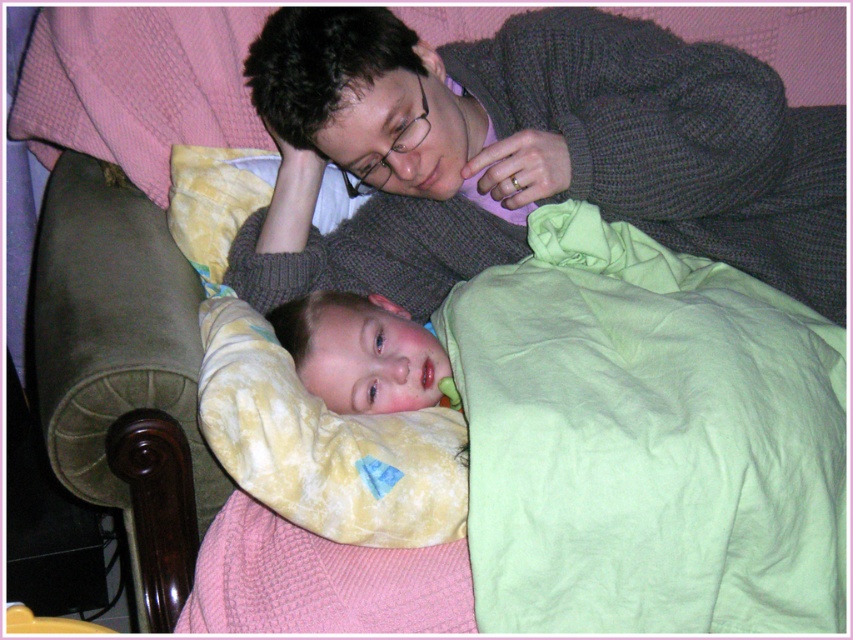
Question: Which point is closer to the camera?

Choices:
 (A) (310, 209)
 (B) (489, 324)

Answer: (B)

Question: Can you confirm if green cotton blanket at lower right is positioned to the left of smooth green pillow at lower center?

Choices:
 (A) no
 (B) yes

Answer: (A)

Question: Which of the following is the closest to the observer?

Choices:
 (A) (450, 323)
 (B) (434, 280)

Answer: (A)

Question: Can you confirm if green cotton blanket at lower right is positioned below knitted dark gray sweater at upper center?

Choices:
 (A) yes
 (B) no

Answer: (A)

Question: Does green cotton blanket at lower right have a larger size compared to knitted dark gray sweater at upper center?

Choices:
 (A) no
 (B) yes

Answer: (A)

Question: Which of these objects is positioned closest to the smooth green pillow at lower center?

Choices:
 (A) green cotton blanket at lower right
 (B) knitted dark gray sweater at upper center

Answer: (A)